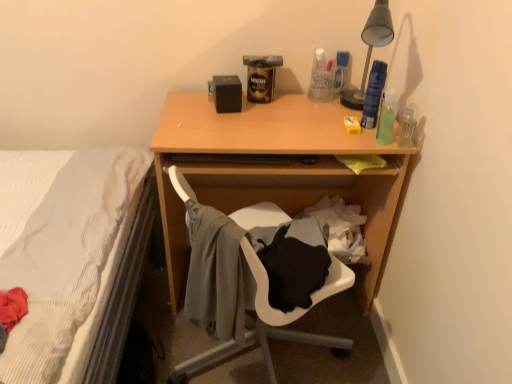
You are a GUI agent. You are given a task and a screenshot of the screen. Output one action in this format:
    pyautogui.click(x=<x>, y=<y>)
    Task: Click on the free space to the left of black matte speaker at upper center
    The width and height of the screenshot is (512, 384).
    Given the screenshot: What is the action you would take?
    pyautogui.click(x=189, y=104)